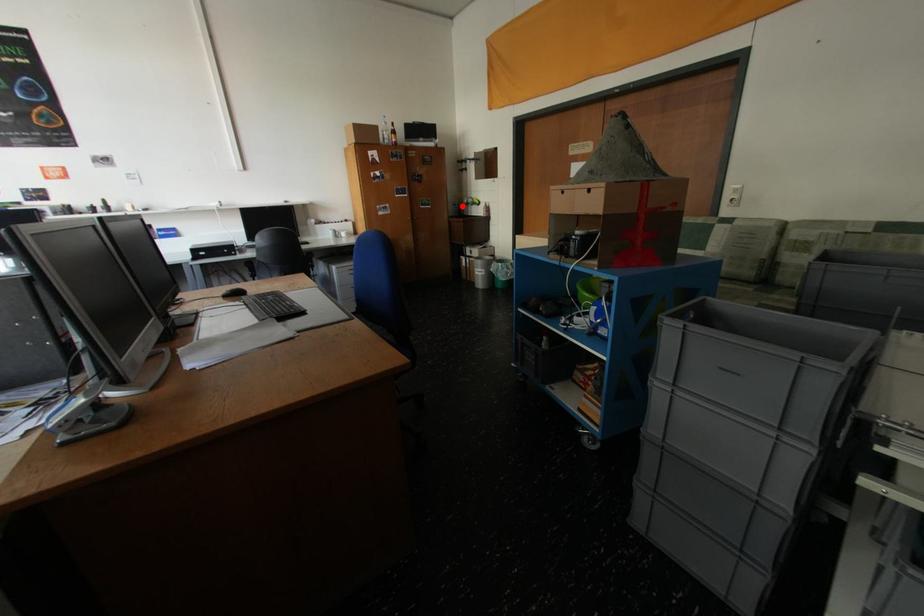
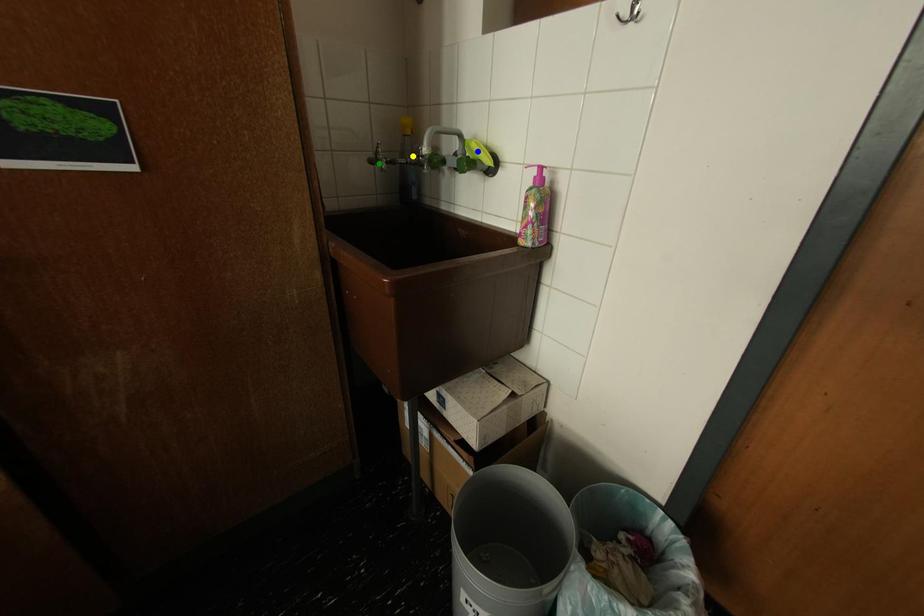
Question: I am providing you with two images of the same scene from different viewpoints. A red point is marked on the first image. You are given multiple points on the second image. In image 2, which mark is for the same physical point as the one in image 1?

Choices:
 (A) green point
 (B) yellow point
 (C) blue point

Answer: (A)